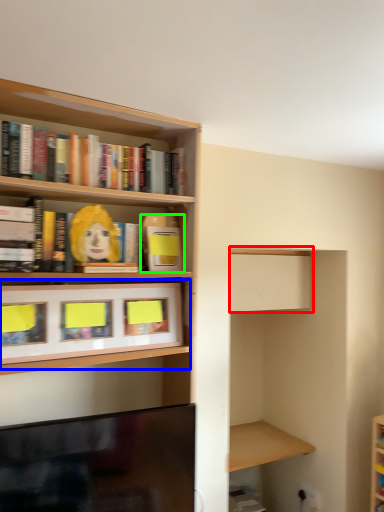
Question: Which object is positioned closest to cabinet (highlighted by a red box)? Select from cabinet (highlighted by a blue box) and book (highlighted by a green box).

Choices:
 (A) cabinet
 (B) book

Answer: (B)